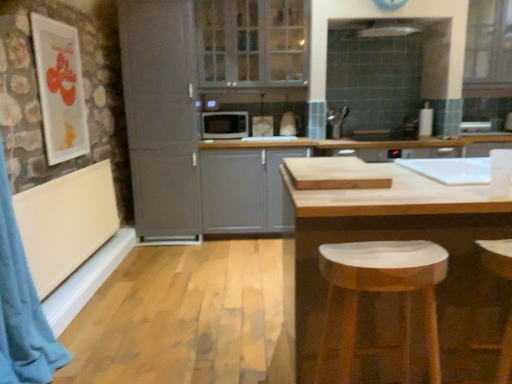
Image resolution: width=512 pixels, height=384 pixels. What are the coordinates of `free spot below matte white picture frame at upper left (from a real-world perspective)` in the screenshot? It's located at (74, 168).